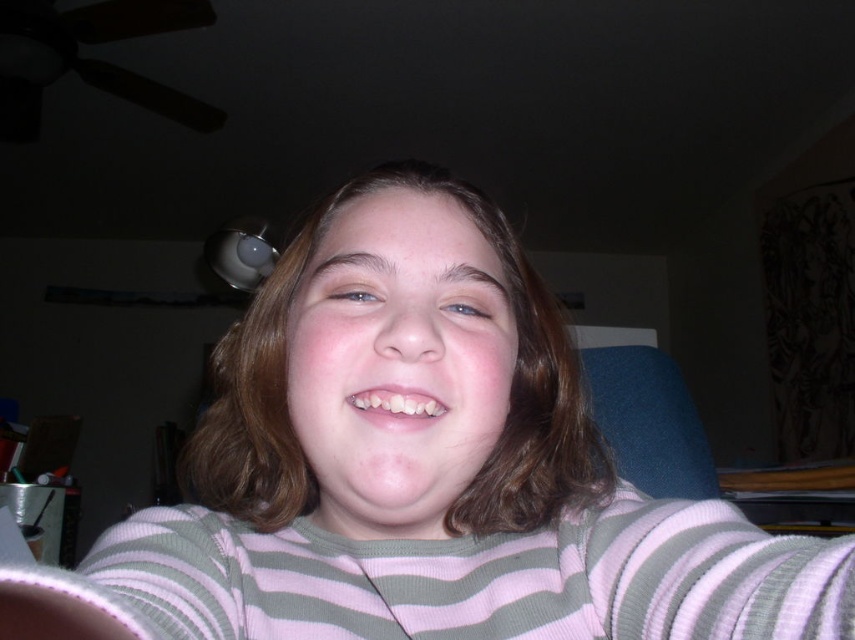
Consider the image. You are a dentist examining a patient. The patient is wearing a pink striped sweater at center and has white glossy teeth at center. You need to take a dental Xray that requires the patient to be at least 5 inches away from any clothing. Can the patient proceed with the Xray as they are?

The distance between the pink striped sweater at center and the white glossy teeth at center is 4.68 inches, which is less than the required 5 inches. The patient needs to move further away from their pink striped sweater at center to ensure safety during the Xray.

You are a photographer trying to capture a closeup of the white glossy teeth at center. However, the pink striped sweater at center might be blocking the shot. Is the sweater above or below the teeth?

The pink striped sweater at center is below the white glossy teeth at center, so it is not blocking the shot.